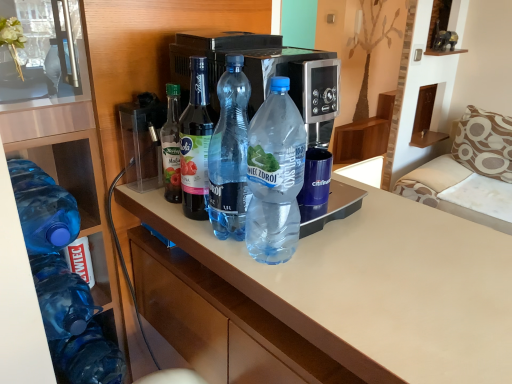
This screenshot has width=512, height=384. Identify the location of free space to the left of transparent plastic bottle at center, the 4th bottle when ordered from left to right. (175, 225).